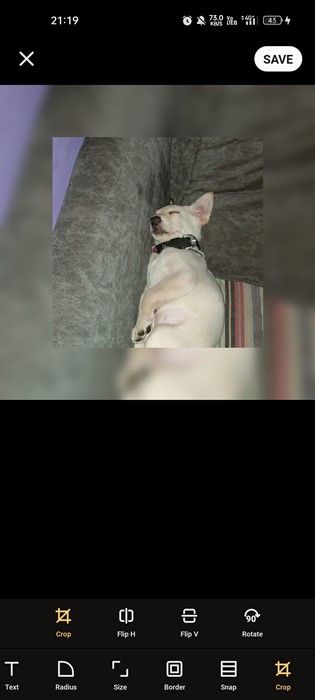
This screenshot has width=315, height=700. I want to click on sofa, so click(110, 253).